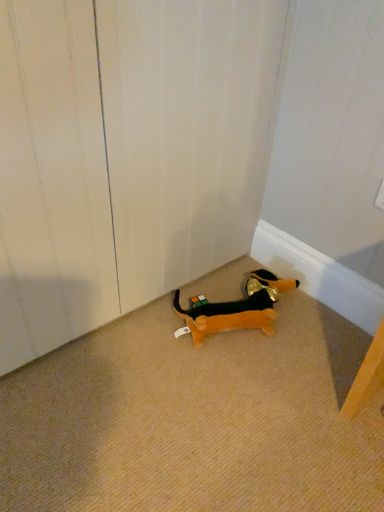
In order to click on vacant space to the right of velvet orange dog at lower center in this screenshot , I will do `click(321, 325)`.